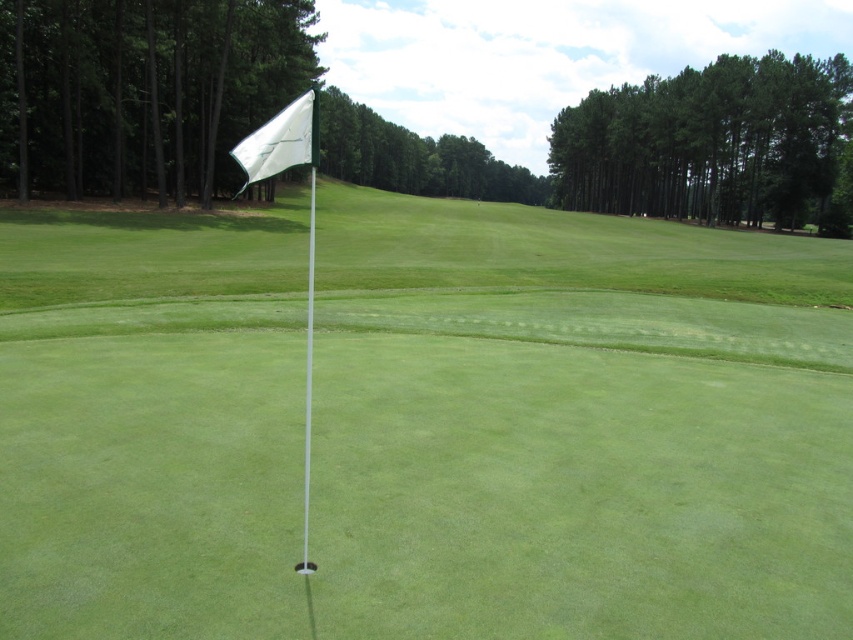
This screenshot has width=853, height=640. Describe the element at coordinates (576, 426) in the screenshot. I see `white fabric flag at center` at that location.

Is white fabric flag at center thinner than white fabric flag at upper center?

In fact, white fabric flag at center might be wider than white fabric flag at upper center.

Locate an element on the screen. The height and width of the screenshot is (640, 853). white fabric flag at center is located at coordinates (576, 426).

This screenshot has width=853, height=640. Find the location of `white fabric flag at center`. white fabric flag at center is located at coordinates (576, 426).

Which of these two, white fabric flag at center or white glossy flag at center, stands shorter?

white fabric flag at center is shorter.

Does point (271, 264) lie behind point (305, 508)?

Yes, point (271, 264) is farther from viewer.

Who is more distant from viewer, (45,592) or (305,554)?

Point (305,554)

Image resolution: width=853 pixels, height=640 pixels. I want to click on white fabric flag at center, so click(576, 426).

Is white fabric flag at upper center smaller than white glossy flag at center?

Yes, white fabric flag at upper center is smaller than white glossy flag at center.

Is point (315, 154) less distant than point (306, 294)?

Yes, point (315, 154) is in front of point (306, 294).

The width and height of the screenshot is (853, 640). Find the location of `white fabric flag at upper center`. white fabric flag at upper center is located at coordinates (280, 141).